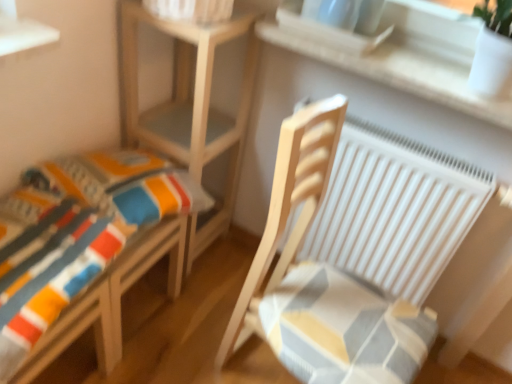
Question: From the image's perspective, would you say wooden rocking chair at right is positioned over natural wood table at center?

Choices:
 (A) no
 (B) yes

Answer: (A)

Question: From the image's perspective, is wooden rocking chair at right under natural wood table at center?

Choices:
 (A) no
 (B) yes

Answer: (B)

Question: Can you confirm if wooden rocking chair at right is positioned to the right of natural wood table at center?

Choices:
 (A) no
 (B) yes

Answer: (B)

Question: Can you confirm if wooden rocking chair at right is bigger than natural wood table at center?

Choices:
 (A) yes
 (B) no

Answer: (A)

Question: Is natural wood table at center at the back of wooden rocking chair at right?

Choices:
 (A) no
 (B) yes

Answer: (B)

Question: Is wooden rocking chair at right touching natural wood table at center?

Choices:
 (A) yes
 (B) no

Answer: (B)

Question: From a real-world perspective, does natural wood table at center stand above striped fabric cushion at lower left?

Choices:
 (A) yes
 (B) no

Answer: (B)

Question: Can you confirm if natural wood table at center is positioned to the right of striped fabric cushion at lower left?

Choices:
 (A) no
 (B) yes

Answer: (B)

Question: Considering the relative sizes of natural wood table at center and striped fabric cushion at lower left in the image provided, is natural wood table at center taller than striped fabric cushion at lower left?

Choices:
 (A) no
 (B) yes

Answer: (B)

Question: Can you confirm if natural wood table at center is bigger than striped fabric cushion at lower left?

Choices:
 (A) no
 (B) yes

Answer: (B)

Question: Can you confirm if natural wood table at center is shorter than striped fabric cushion at lower left?

Choices:
 (A) no
 (B) yes

Answer: (A)

Question: Does natural wood table at center have a greater width compared to striped fabric cushion at lower left?

Choices:
 (A) yes
 (B) no

Answer: (B)

Question: Is the surface of wooden rocking chair at right in direct contact with white matte radiator at right?

Choices:
 (A) no
 (B) yes

Answer: (A)